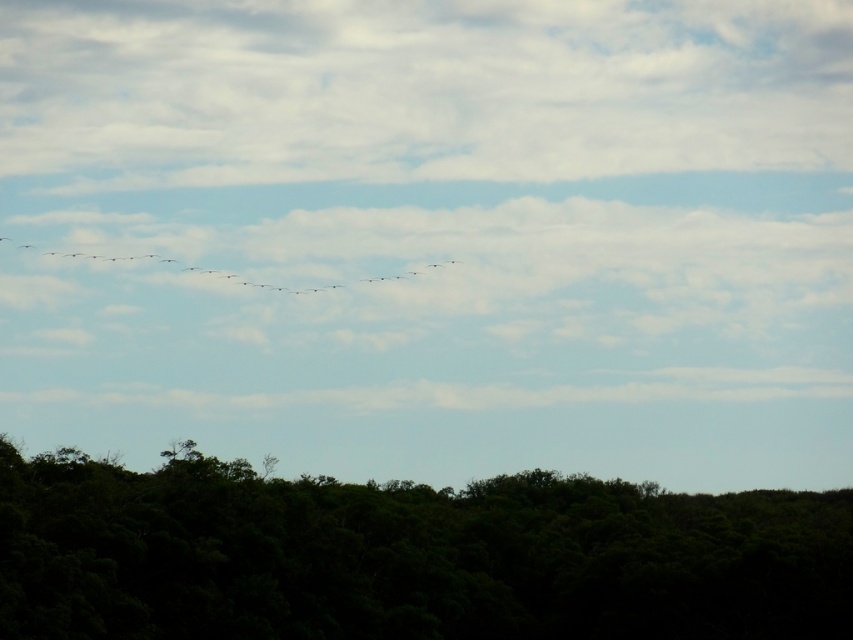
You are an ornithologist observing birds in the sky. You notice two birds in the image, the gray matte birds at center and the silhouette feathered bird at left. Which bird appears closer to you based on their positions in the scene?

The gray matte birds at center appears closer to you because it is positioned in front of the silhouette feathered bird at left.

You are an observer looking at the scene. Which object is closer to you between the green leafy trees at lower center and the silhouette feathered bird at left?

The green leafy trees at lower center are closer to you than the silhouette feathered bird at left.